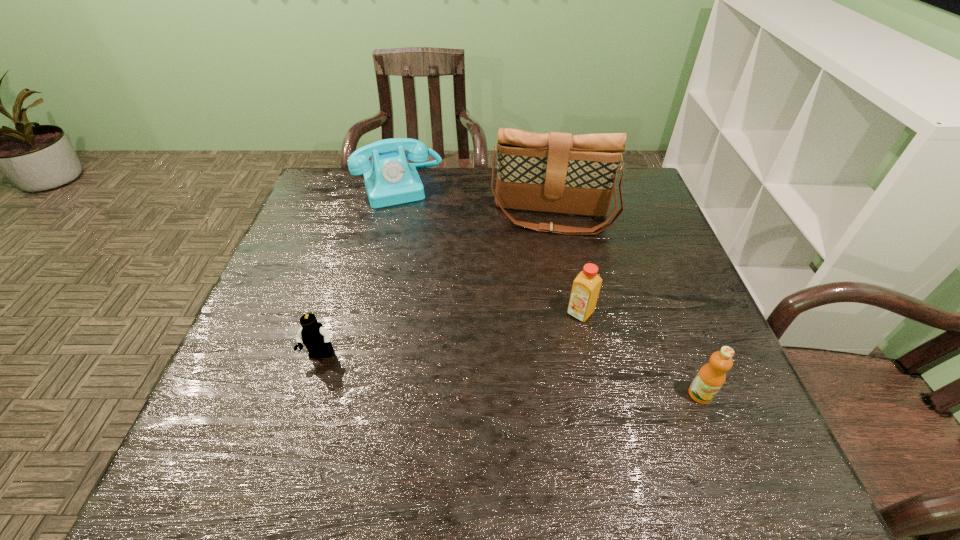
Find the location of a particular element. The height and width of the screenshot is (540, 960). free space that is in between the fourth farthest object and the nearer orange juice is located at coordinates (511, 375).

In order to click on empty space between the telephone and the nearest object in this screenshot , I will do `click(550, 291)`.

Identify which object is located as the fourth nearest to the farther orange juice. Please provide its 2D coordinates. Your answer should be formatted as a tuple, i.e. [(x, y)], where the tuple contains the x and y coordinates of a point satisfying the conditions above.

[(316, 338)]

Locate which object is the second closest to the tallest object. Please provide its 2D coordinates. Your answer should be formatted as a tuple, i.e. [(x, y)], where the tuple contains the x and y coordinates of a point satisfying the conditions above.

[(585, 290)]